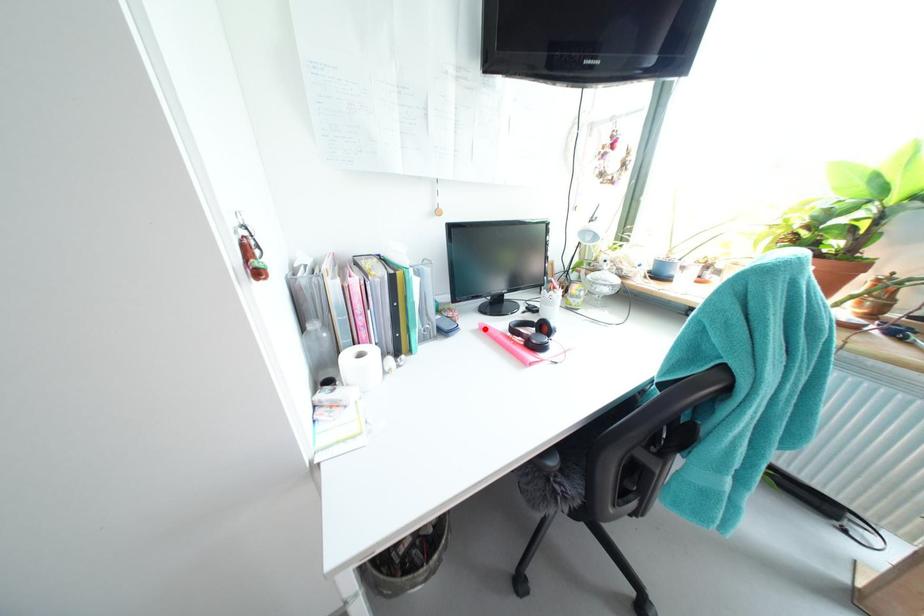
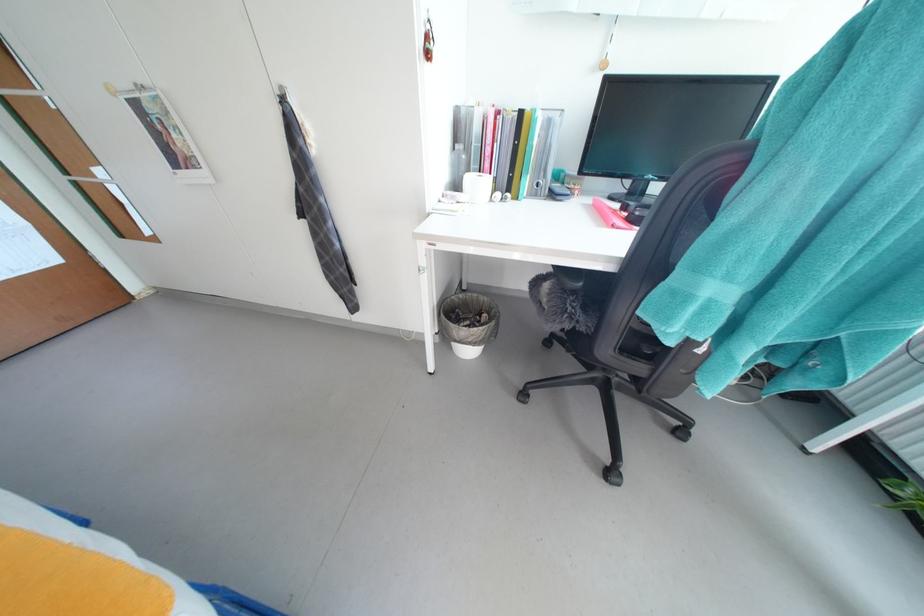
The point at the highlighted location is marked in the first image. Where is the corresponding point in the second image?

(599, 204)